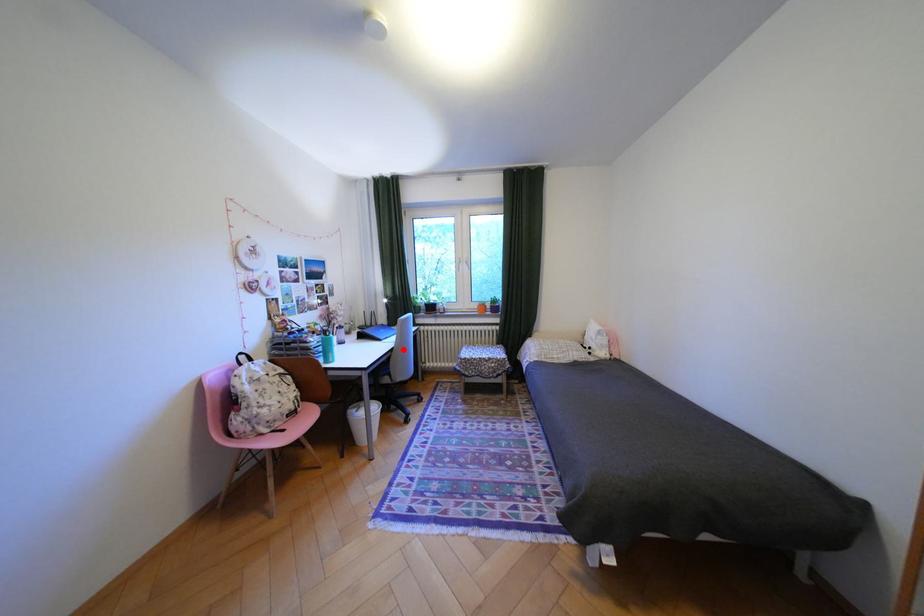
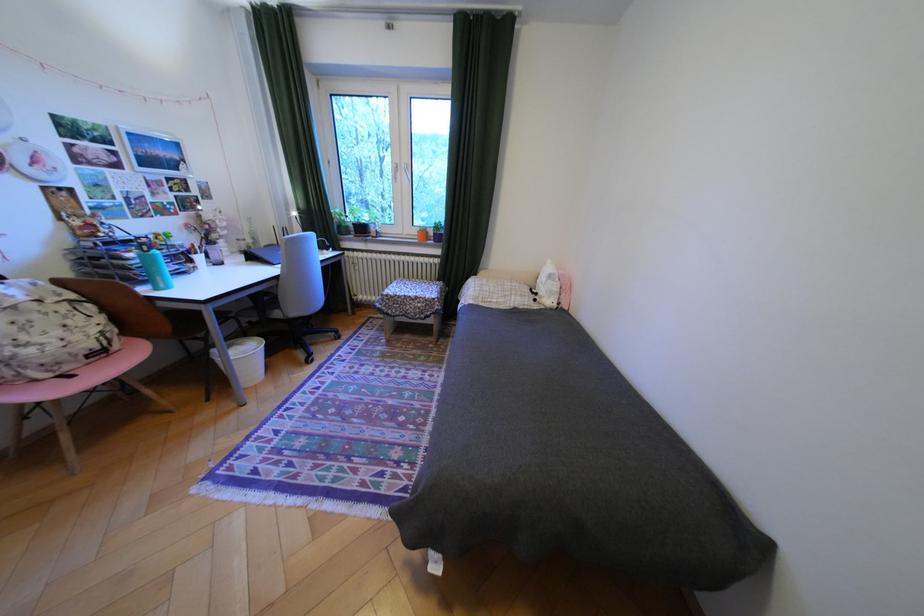
Where in the second image is the point corresponding to the highlighted location from the first image?

(288, 278)